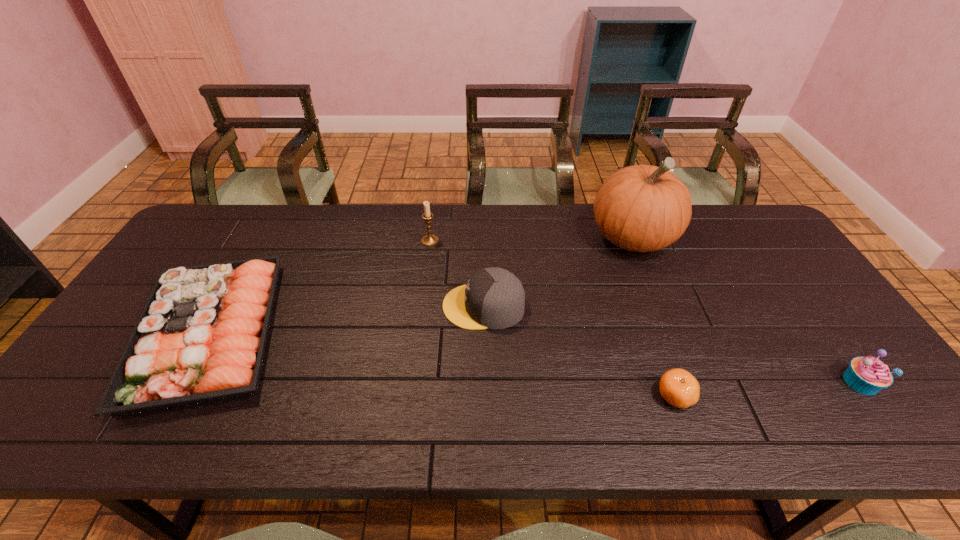
The image size is (960, 540). Identify the location of pumpkin. (642, 208).

This screenshot has height=540, width=960. What are the coordinates of `candle holder` in the screenshot? It's located at (429, 240).

Locate an element on the screen. This screenshot has height=540, width=960. the fifth shortest object is located at coordinates (429, 240).

You are a GUI agent. You are given a task and a screenshot of the screen. Output one action in this format:
    pyautogui.click(x=<x>, y=<y>)
    Task: Click on the third object from left to right
    The width and height of the screenshot is (960, 540).
    Given the screenshot: What is the action you would take?
    pyautogui.click(x=494, y=298)

This screenshot has width=960, height=540. Find the location of `muffin`. muffin is located at coordinates (868, 375).

I want to click on clementine, so click(678, 387).

Identify the location of the leftmost object. The image size is (960, 540). (201, 337).

Locate an element on the screen. vacant space located on the stem of the tallest object is located at coordinates (659, 305).

This screenshot has width=960, height=540. I want to click on free space located 0.260m on the right of the second tallest object, so click(x=520, y=241).

In order to click on blank area located 0.300m on the front-facing side of the third object from left to right in this screenshot , I will do `click(334, 306)`.